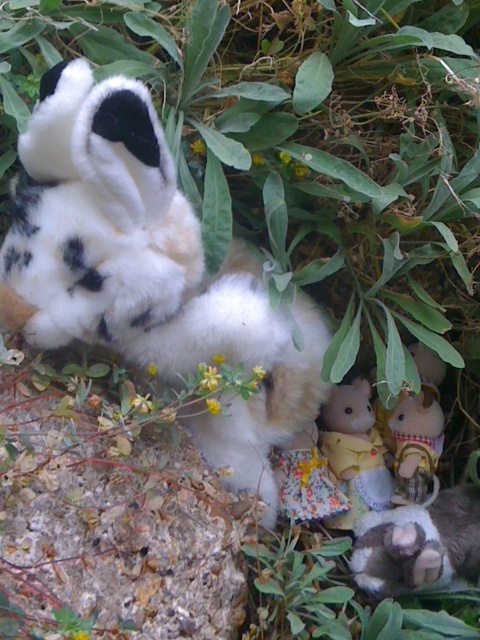
You are a child who wants to arrange the fluffy fabric doll at center and the yellow fabric doll at lower right in a straight line from left to right. Based on their current positions, which doll should you place first on the left side?

The fluffy fabric doll at center should be placed first on the left side because it is currently positioned on the left side of the yellow fabric doll at lower right.

You are a child looking at the image and want to pick up the fluffy white paw at lower right and the yellow fabric doll at lower right. Which toy is closer to your right hand if you are facing the image?

The fluffy white paw at lower right is to the right of the yellow fabric doll at lower right, so it would be closer to your right hand when facing the image.